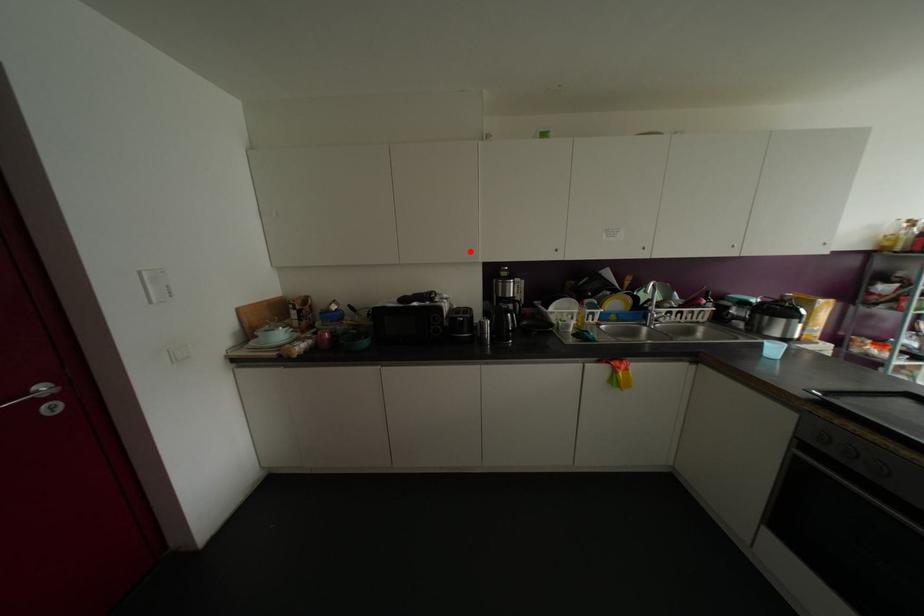
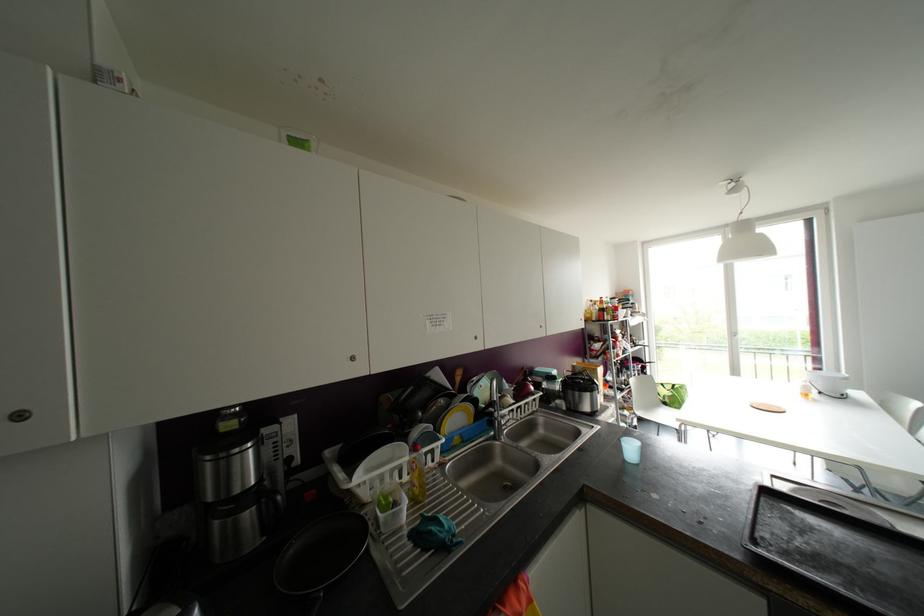
Locate, in the second image, the point that corresponds to the highlighted location in the first image.

(19, 416)